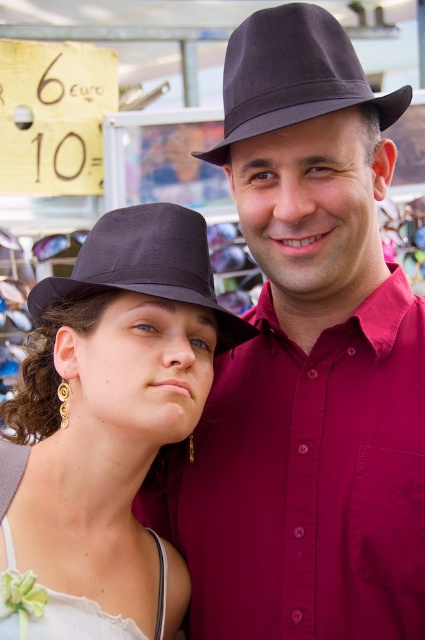
Question: Is matte black fedora at center further to the viewer compared to white satin dress at lower left?

Choices:
 (A) no
 (B) yes

Answer: (B)

Question: Which is farther from the white satin dress at lower left?

Choices:
 (A) matte black fedora at center
 (B) matte black fedora at upper left
 (C) matte black hat at upper left

Answer: (A)

Question: Does matte black hat at upper left have a greater width compared to matte black fedora at center?

Choices:
 (A) no
 (B) yes

Answer: (B)

Question: Is matte black hat at upper left above white satin dress at lower left?

Choices:
 (A) yes
 (B) no

Answer: (A)

Question: Among these points, which one is nearest to the camera?

Choices:
 (A) (271, 10)
 (B) (379, 556)
 (C) (48, 500)
 (D) (31, 612)

Answer: (D)

Question: Which point is closer to the camera taking this photo?

Choices:
 (A) (51, 628)
 (B) (197, 248)

Answer: (A)